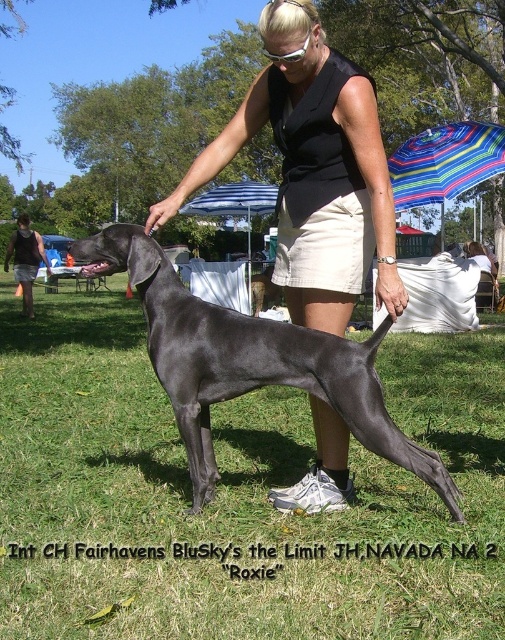
Question: Considering the real-world distances, which object is farthest from the black matte skirt at center?

Choices:
 (A) shiny black dog at center
 (B) green grass at center

Answer: (B)

Question: Is green grass at center positioned before shiny black dog at center?

Choices:
 (A) no
 (B) yes

Answer: (B)

Question: Which point appears closest to the camera in this image?

Choices:
 (A) (368, 435)
 (B) (432, 392)

Answer: (A)

Question: Which point is closer to the camera taking this photo?

Choices:
 (A) (219, 397)
 (B) (483, 404)

Answer: (A)

Question: Can you confirm if green grass at center is positioned below black matte skirt at center?

Choices:
 (A) no
 (B) yes

Answer: (B)

Question: Is black matte skirt at center closer to camera compared to shiny black dog at center?

Choices:
 (A) yes
 (B) no

Answer: (B)